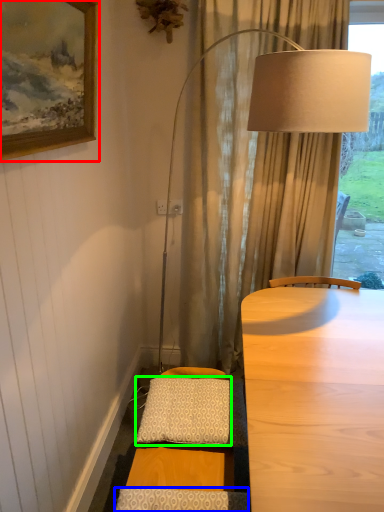
Question: Which is farther away from picture frame (highlighted by a red box)? pillow (highlighted by a blue box) or pillow (highlighted by a green box)?

Choices:
 (A) pillow
 (B) pillow

Answer: (A)